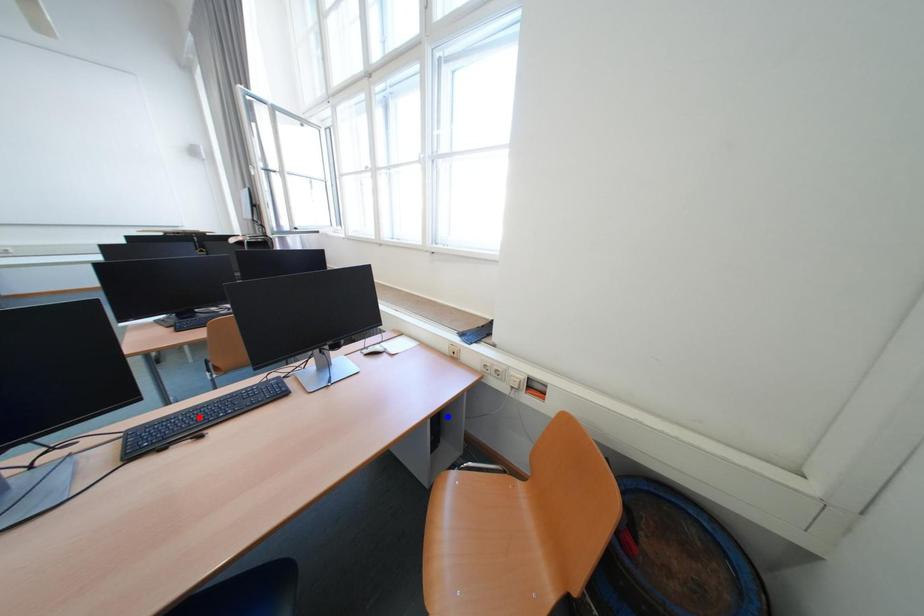
Question: Two points are marked on the image. Which point is closer to the camera?

Choices:
 (A) Blue point is closer.
 (B) Red point is closer.

Answer: (B)